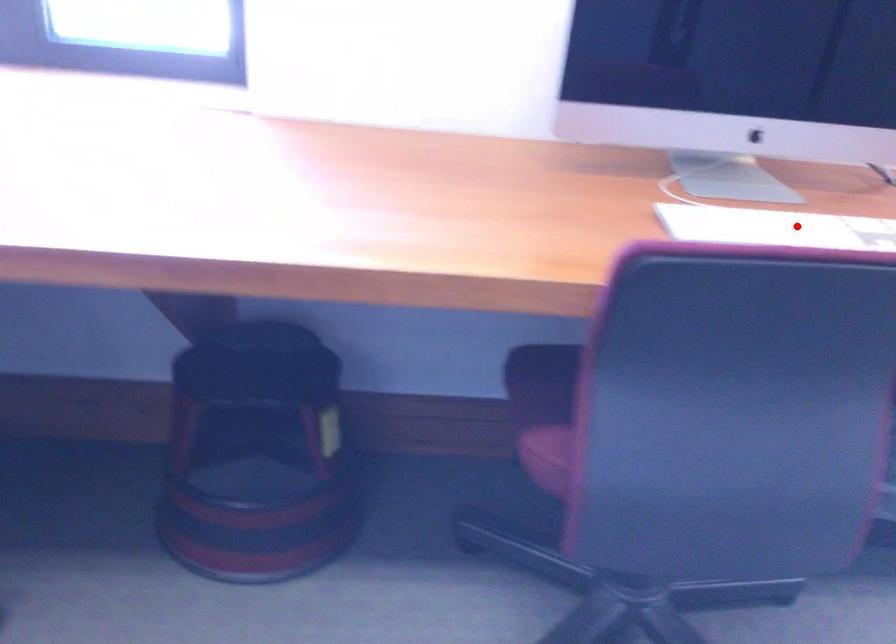
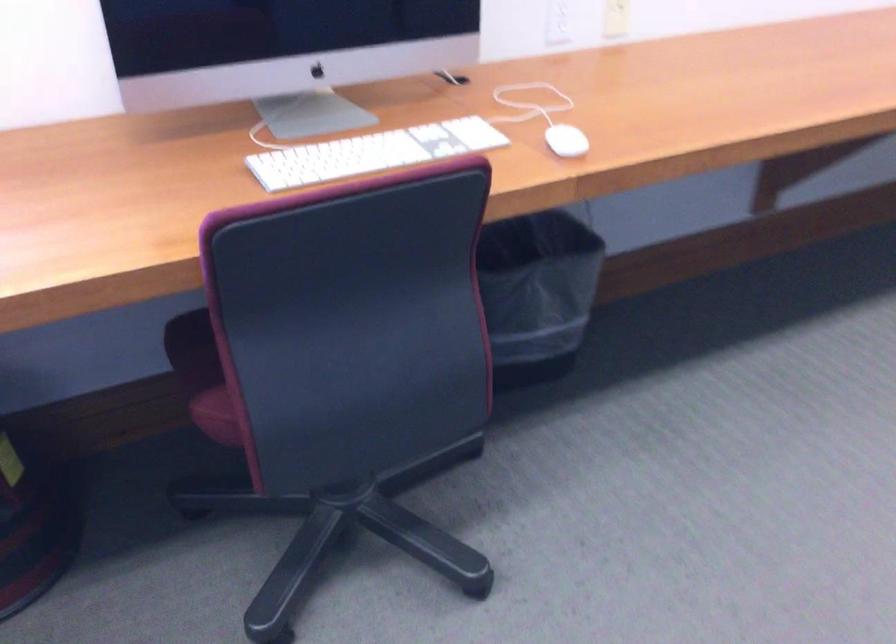
Question: I am providing you with two images of the same scene from different viewpoints. Image1 has a red point marked. In image2, the corresponding 3D location appears at what relative position? Reply with the corresponding letter.

Choices:
 (A) Closer
 (B) Farther

Answer: (B)